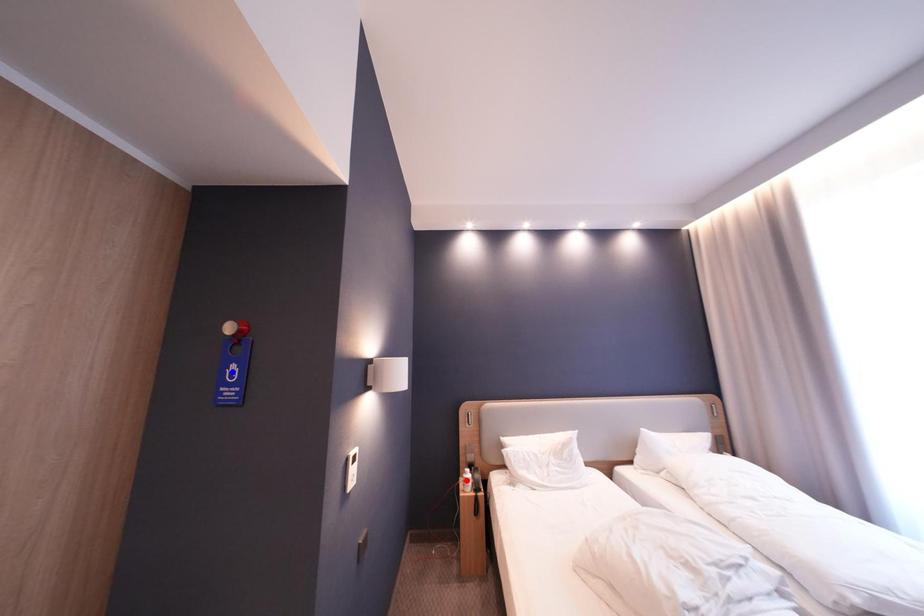
Question: In the image, two points are highlighted. Which point is nearer to the camera? Reply with the corresponding letter.

Choices:
 (A) blue point
 (B) red point

Answer: (A)